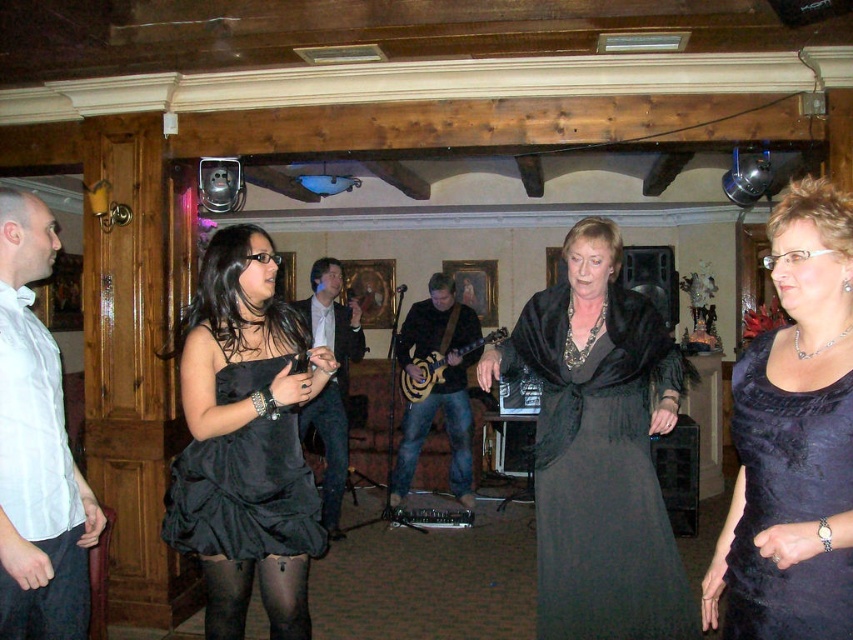
You are a photographer at the event and need to capture both the white satin shirt at left and the wooden electric guitar at center in a single frame. Which object should you focus on first to ensure both are visible?

Since the white satin shirt at left occupies less space than the wooden electric guitar at center, you should focus on the wooden electric guitar at center first to ensure both are visible in the frame.

You are a photographer at the event and need to capture both the white satin shirt at left and the wooden electric guitar at center in a single frame. Which object should you zoom in on to ensure both are visible without cropping?

The white satin shirt at left is narrower than the wooden electric guitar at center, so you should zoom in on the wooden electric guitar at center to ensure both fit in the frame.